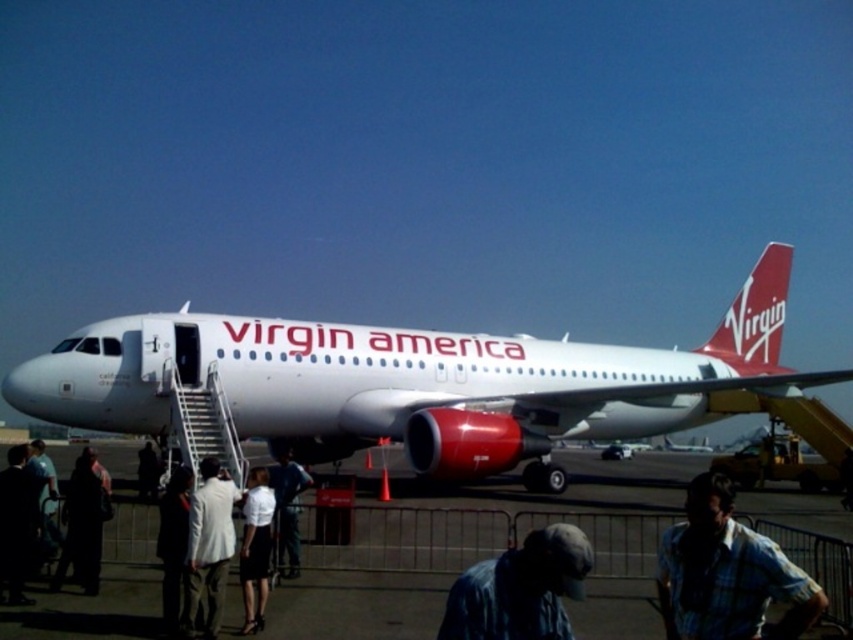
Is blue plaid shirt at lower right above denim jacket at lower right?

Yes, blue plaid shirt at lower right is above denim jacket at lower right.

Is blue plaid shirt at lower right shorter than denim jacket at lower right?

No, blue plaid shirt at lower right is not shorter than denim jacket at lower right.

Is point (688, 598) positioned behind point (538, 573)?

Yes, point (688, 598) is farther from viewer.

What are the coordinates of `blue plaid shirt at lower right` in the screenshot? It's located at (727, 573).

Is point (718, 508) positioned after point (1, 483)?

No, it is in front of (1, 483).

Is point (751, 636) closer to camera compared to point (16, 572)?

Yes, it is in front of point (16, 572).

Is point (784, 634) farther from viewer compared to point (1, 518)?

No.

Find the location of a particular element. This screenshot has height=640, width=853. blue plaid shirt at lower right is located at coordinates (727, 573).

Can you confirm if dark fabric coat at lower left is positioned below dark gray fabric jacket at lower left?

Yes.

Who is shorter, dark fabric coat at lower left or dark gray fabric jacket at lower left?

With less height is dark gray fabric jacket at lower left.

This screenshot has width=853, height=640. What do you see at coordinates (84, 522) in the screenshot? I see `dark fabric coat at lower left` at bounding box center [84, 522].

This screenshot has height=640, width=853. I want to click on dark fabric coat at lower left, so click(84, 522).